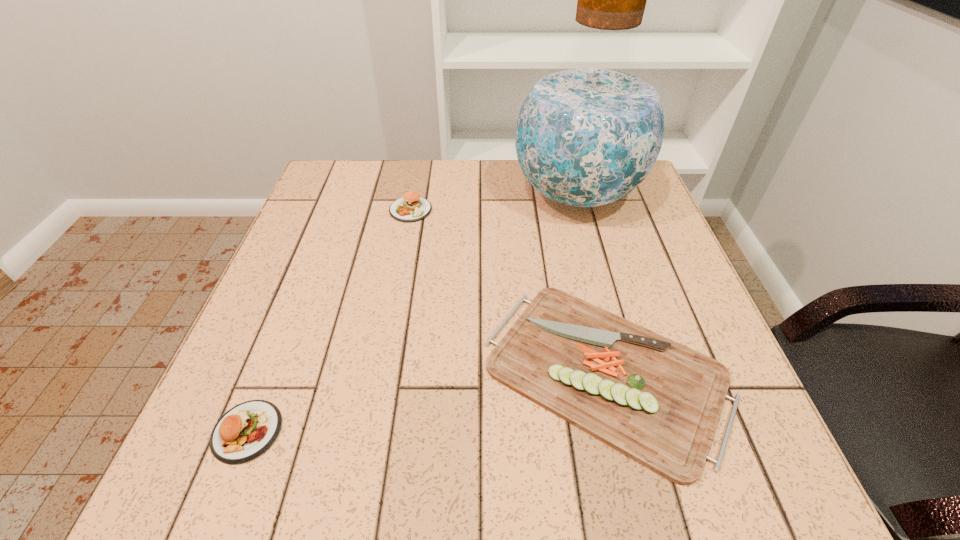
At what (x,y) coordinates should I click in order to perform the action: click on vacant region between the shortest object and the farther patty (food). Please return your answer as a coordinate pair (x, y). Looking at the image, I should click on (508, 291).

Locate an element on the screen. This screenshot has height=540, width=960. free space that is in between the farther patty (food) and the chopping board is located at coordinates (508, 291).

Locate an element on the screen. vacant space in between the shorter patty (food) and the chopping board is located at coordinates click(x=426, y=401).

Where is `free spot between the shortest object and the left patty (food)`? free spot between the shortest object and the left patty (food) is located at coordinates pos(426,401).

Image resolution: width=960 pixels, height=540 pixels. I want to click on unoccupied area between the shortest object and the nearer patty (food), so click(426, 401).

Find the location of a particular element. The height and width of the screenshot is (540, 960). blank region between the nearer patty (food) and the water jug is located at coordinates (412, 313).

The width and height of the screenshot is (960, 540). Identify the location of unoccupied area between the chopping board and the water jug. (591, 283).

The width and height of the screenshot is (960, 540). In order to click on object that is the second nearest to the chopping board in this screenshot , I will do `click(411, 207)`.

Identify which object is located as the third nearest to the water jug. Please provide its 2D coordinates. Your answer should be formatted as a tuple, i.e. [(x, y)], where the tuple contains the x and y coordinates of a point satisfying the conditions above.

[(247, 430)]